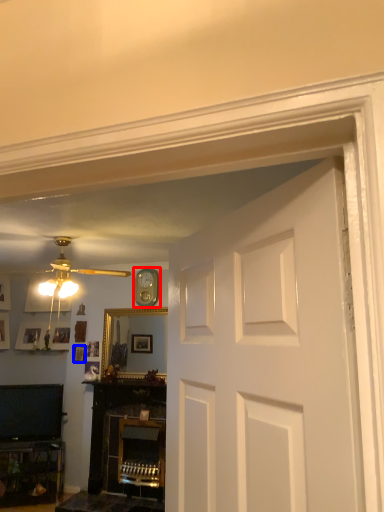
Question: Which object appears farthest to the camera in this image, clock (highlighted by a red box) or picture frame (highlighted by a blue box)?

Choices:
 (A) clock
 (B) picture frame

Answer: (B)